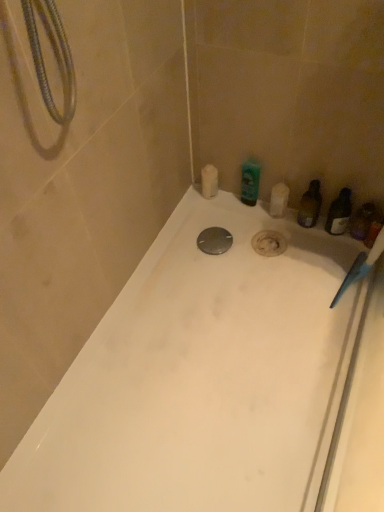
Image resolution: width=384 pixels, height=512 pixels. Find the location of `free location in front of white matte soap bar at upper center, the fourth toiletry positioned from the right`. free location in front of white matte soap bar at upper center, the fourth toiletry positioned from the right is located at coordinates (211, 228).